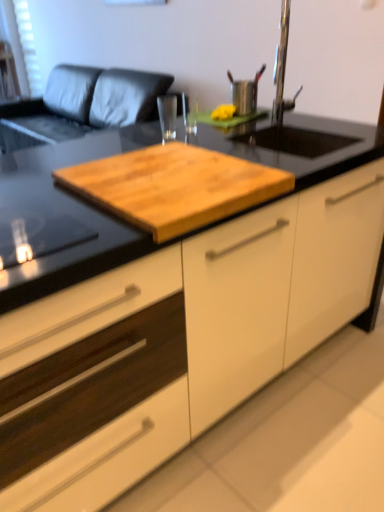
Describe the element at coordinates (204, 328) in the screenshot. The width and height of the screenshot is (384, 512). I see `white matte cabinet at center` at that location.

At what (x,y) coordinates should I click in order to perform the action: click on natural wood cutting board at center. Please return your answer as a coordinate pair (x, y). Looking at the image, I should click on (174, 187).

In order to face leather couch at upper left, should I rotate leftwards or rightwards?

Rotate left and turn 14.717 degrees.

Describe the element at coordinates (87, 102) in the screenshot. Image resolution: width=384 pixels, height=512 pixels. I see `leather couch at upper left` at that location.

Find the location of a particular element. The height and width of the screenshot is (512, 384). white mesh screen at upper left is located at coordinates (22, 45).

How far apart are leather couch at upper left and white mesh screen at upper left?

leather couch at upper left and white mesh screen at upper left are 73.56 centimeters apart from each other.

Is leather couch at upper left turned away from white mesh screen at upper left?

No.

Are leather couch at upper left and white mesh screen at upper left located far from each other?

Actually, leather couch at upper left and white mesh screen at upper left are a little close together.

Which object is closer to the camera, leather couch at upper left or white mesh screen at upper left?

leather couch at upper left.

How many degrees apart are the facing directions of natural wood cutting board at center and white mesh screen at upper left?

There is a 0.886-degree angle between the facing directions of natural wood cutting board at center and white mesh screen at upper left.

Between natural wood cutting board at center and white mesh screen at upper left, which one has smaller size?

natural wood cutting board at center.

Consider the image. From the image's perspective, does natural wood cutting board at center appear higher than white mesh screen at upper left?

No, from the image's perspective, natural wood cutting board at center is not above white mesh screen at upper left.

From the picture: From a real-world perspective, is white mesh screen at upper left above or below white matte cabinet at center?

Clearly, from a real-world perspective, white mesh screen at upper left is above white matte cabinet at center.

Is white mesh screen at upper left placed right next to white matte cabinet at center?

No.

Does white mesh screen at upper left have a lesser width compared to white matte cabinet at center?

Correct, the width of white mesh screen at upper left is less than that of white matte cabinet at center.

From the image's perspective, is white mesh screen at upper left located beneath white matte cabinet at center?

No, from the image's perspective, white mesh screen at upper left is not beneath white matte cabinet at center.

In terms of width, does metallic stainless steel cup at upper center look wider or thinner when compared to natural wood cutting board at center?

In the image, metallic stainless steel cup at upper center appears to be more narrow than natural wood cutting board at center.

Can we say metallic stainless steel cup at upper center lies outside natural wood cutting board at center?

Absolutely, metallic stainless steel cup at upper center is external to natural wood cutting board at center.

From the image's perspective, which one is positioned higher, metallic stainless steel cup at upper center or natural wood cutting board at center?

From the image's view, metallic stainless steel cup at upper center is above.

Are metallic stainless steel cup at upper center and natural wood cutting board at center far apart?

No, metallic stainless steel cup at upper center is not far from natural wood cutting board at center.

Looking at this image, does leather couch at upper left contain white matte cabinet at center?

No, leather couch at upper left does not contain white matte cabinet at center.

In the image, is leather couch at upper left positioned in front of or behind white matte cabinet at center?

leather couch at upper left is behind white matte cabinet at center.

Is leather couch at upper left oriented away from white matte cabinet at center?

No, leather couch at upper left is not facing away from white matte cabinet at center.

Does point (74, 126) lie behind point (333, 321)?

Yes, it is.

Is metallic stainless steel cup at upper center inside white matte cabinet at center?

No, white matte cabinet at center does not contain metallic stainless steel cup at upper center.

Is white matte cabinet at center smaller than metallic stainless steel cup at upper center?

Actually, white matte cabinet at center might be larger than metallic stainless steel cup at upper center.

Consider the image. Is there a large distance between white matte cabinet at center and metallic stainless steel cup at upper center?

white matte cabinet at center is positioned a significant distance from metallic stainless steel cup at upper center.

Is white matte cabinet at center turned away from metallic stainless steel cup at upper center?

No, white matte cabinet at center is not facing the opposite direction of metallic stainless steel cup at upper center.

Between natural wood cutting board at center and white matte cabinet at center, which one has more height?

white matte cabinet at center.

Looking at this image, from a real-world perspective, is natural wood cutting board at center over white matte cabinet at center?

Yes, from a real-world perspective, natural wood cutting board at center is above white matte cabinet at center.

Which object is further away from the camera taking this photo, natural wood cutting board at center or white matte cabinet at center?

natural wood cutting board at center.

Identify the location of window screen located on the left of leather couch at upper left. (22, 45).

In the image, there is a natural wood cutting board at center. In order to click on window screen above it (from the image's perspective) in this screenshot , I will do [22, 45].

Based on the photo, looking at the image, which one is located further to metallic stainless steel cup at upper center, white mesh screen at upper left or natural wood cutting board at center?

white mesh screen at upper left.

When comparing their distances from white matte cabinet at center, does metallic stainless steel cup at upper center or white mesh screen at upper left seem further?

white mesh screen at upper left.

Based on their spatial positions, is natural wood cutting board at center or white matte cabinet at center further from leather couch at upper left?

Among the two, white matte cabinet at center is located further to leather couch at upper left.

Which object lies nearer to the anchor point natural wood cutting board at center, white mesh screen at upper left or metallic stainless steel cup at upper center?

Among the two, metallic stainless steel cup at upper center is located nearer to natural wood cutting board at center.

Based on their spatial positions, is white mesh screen at upper left or leather couch at upper left closer to metallic stainless steel cup at upper center?

leather couch at upper left is positioned closer to the anchor metallic stainless steel cup at upper center.

Based on their spatial positions, is white mesh screen at upper left or metallic stainless steel cup at upper center closer to leather couch at upper left?

Among the two, white mesh screen at upper left is located nearer to leather couch at upper left.

When comparing their distances from natural wood cutting board at center, does white mesh screen at upper left or leather couch at upper left seem closer?

Based on the image, leather couch at upper left appears to be nearer to natural wood cutting board at center.

From the image, which object appears to be nearer to white mesh screen at upper left, metallic stainless steel cup at upper center or leather couch at upper left?

leather couch at upper left is closer to white mesh screen at upper left.

This screenshot has height=512, width=384. Find the location of `appliance positioned between natural wood cutting board at center and white mesh screen at upper left from near to far`. appliance positioned between natural wood cutting board at center and white mesh screen at upper left from near to far is located at coordinates 245,93.

This screenshot has width=384, height=512. Identify the location of couch located between natural wood cutting board at center and white mesh screen at upper left in the depth direction. (87, 102).

The image size is (384, 512). What are the coordinates of `wood between white matte cabinet at center and metallic stainless steel cup at upper center in the front-back direction` in the screenshot? It's located at (174, 187).

Identify the location of appliance located between white matte cabinet at center and white mesh screen at upper left in the depth direction. (245, 93).